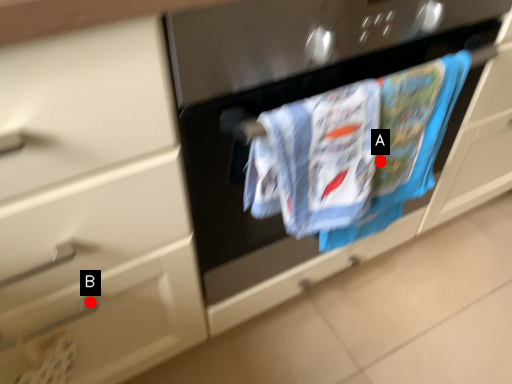
Question: Two points are circled on the image, labeled by A and B beside each circle. Which point is farther to the camera?

Choices:
 (A) A is further
 (B) B is further

Answer: (A)